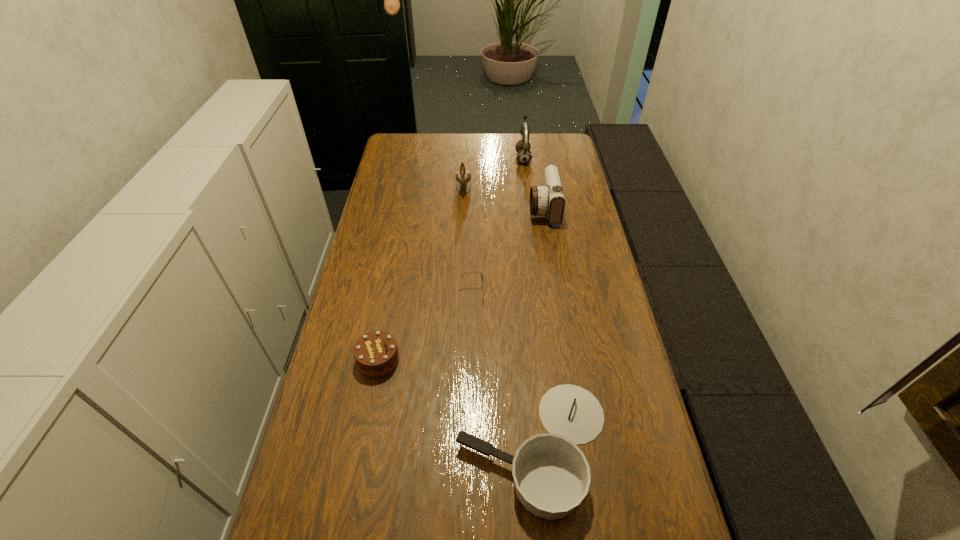
The image size is (960, 540). Identify the location of camcorder present at the right edge. (548, 199).

Where is `saucepan present at the right edge`? The height and width of the screenshot is (540, 960). saucepan present at the right edge is located at coordinates (551, 474).

Locate an element on the screen. The width and height of the screenshot is (960, 540). free space at the far edge is located at coordinates (458, 146).

In the image, there is a desktop. Identify the location of free space at the left edge. The image size is (960, 540). (381, 248).

Find the location of a particular element. This screenshot has height=540, width=960. vacant space at the right edge of the desktop is located at coordinates (568, 181).

This screenshot has height=540, width=960. In the image, there is a desktop. What are the coordinates of `blank space at the far right corner` in the screenshot? It's located at [x=569, y=156].

Where is `blank region between the sunglasses and the second nearest object`? This screenshot has width=960, height=540. blank region between the sunglasses and the second nearest object is located at coordinates (425, 326).

The height and width of the screenshot is (540, 960). In order to click on free space between the leftmost object and the sunglasses in this screenshot , I will do `click(425, 326)`.

Locate an element on the screen. The height and width of the screenshot is (540, 960). free point between the camcorder and the farthest object is located at coordinates (534, 184).

Locate an element on the screen. The height and width of the screenshot is (540, 960). vacant area that lies between the nearest object and the third nearest object is located at coordinates (503, 370).